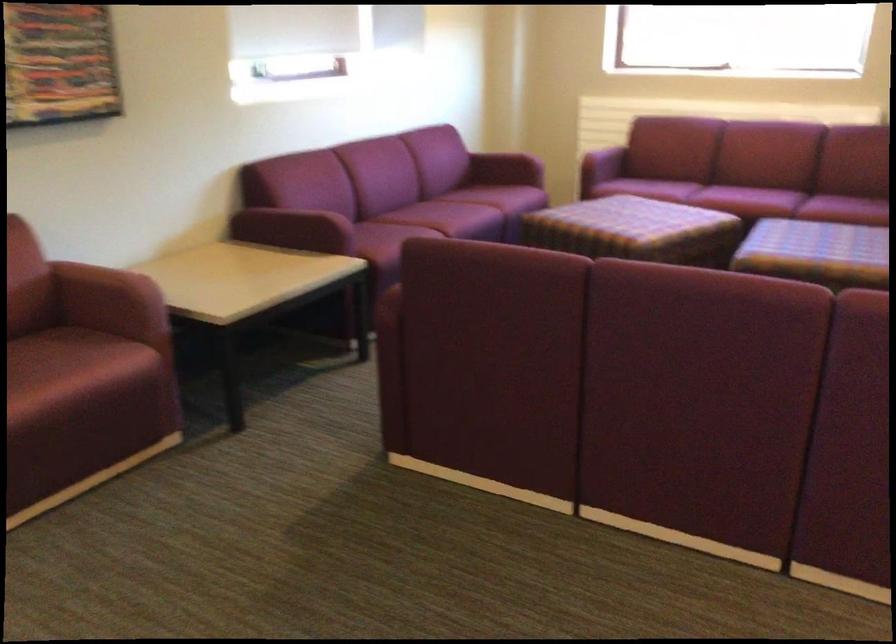
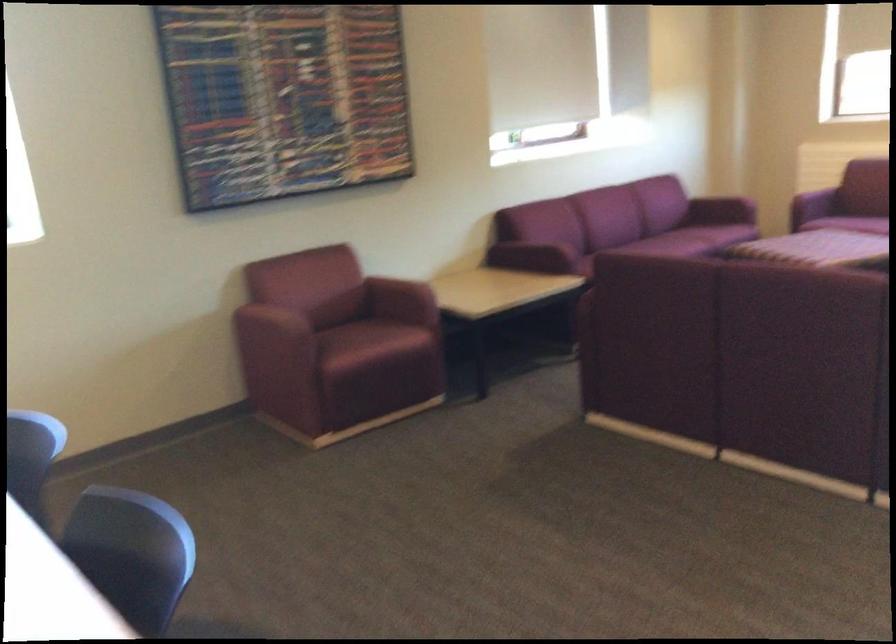
Where in the second image is the point corresponding to point (471, 204) from the first image?

(683, 242)